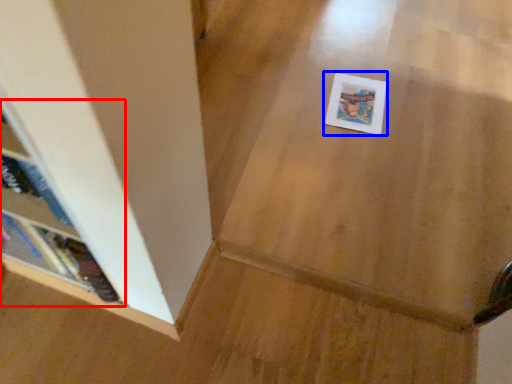
Question: Among these objects, which one is farthest to the camera, shelf (highlighted by a red box) or postcard (highlighted by a blue box)?

Choices:
 (A) shelf
 (B) postcard

Answer: (B)